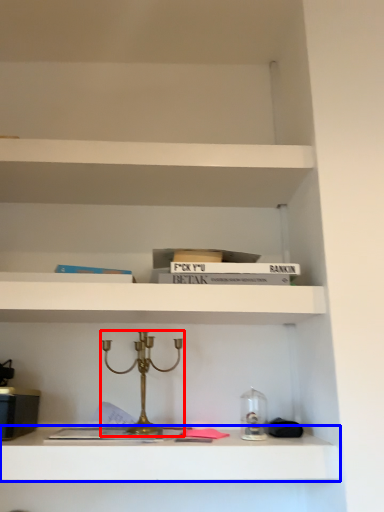
Question: Which object appears closest to the camera in this image, candle holder (highlighted by a red box) or shelf (highlighted by a blue box)?

Choices:
 (A) candle holder
 (B) shelf

Answer: (B)